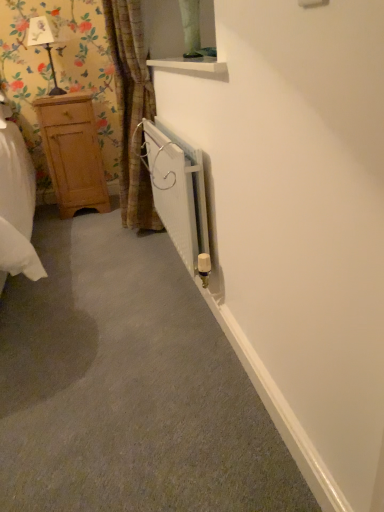
Question: Is brown textured curtain at left in front of white metallic radiator at center?

Choices:
 (A) no
 (B) yes

Answer: (A)

Question: Is brown textured curtain at left to the left of white metallic radiator at center from the viewer's perspective?

Choices:
 (A) yes
 (B) no

Answer: (A)

Question: Is brown textured curtain at left outside white metallic radiator at center?

Choices:
 (A) no
 (B) yes

Answer: (B)

Question: Are brown textured curtain at left and white metallic radiator at center located far from each other?

Choices:
 (A) no
 (B) yes

Answer: (A)

Question: From the image's perspective, is brown textured curtain at left above white metallic radiator at center?

Choices:
 (A) yes
 (B) no

Answer: (A)

Question: Considering the relative positions of brown textured curtain at left and white metallic radiator at center in the image provided, is brown textured curtain at left to the left or to the right of white metallic radiator at center?

Choices:
 (A) left
 (B) right

Answer: (A)

Question: Is brown textured curtain at left in front of or behind white metallic radiator at center in the image?

Choices:
 (A) behind
 (B) front

Answer: (A)

Question: Considering the positions of point (130, 220) and point (185, 153), is point (130, 220) closer or farther from the camera than point (185, 153)?

Choices:
 (A) closer
 (B) farther

Answer: (B)

Question: From their relative heights in the image, would you say brown textured curtain at left is taller or shorter than white metallic radiator at center?

Choices:
 (A) short
 (B) tall

Answer: (B)

Question: Do you think light brown wooden dresser at left is within matte black lamp at upper left, or outside of it?

Choices:
 (A) outside
 (B) inside

Answer: (A)

Question: In terms of size, does light brown wooden dresser at left appear bigger or smaller than matte black lamp at upper left?

Choices:
 (A) big
 (B) small

Answer: (A)

Question: Relative to matte black lamp at upper left, is light brown wooden dresser at left in front or behind?

Choices:
 (A) behind
 (B) front

Answer: (A)

Question: Looking at their shapes, would you say light brown wooden dresser at left is wider or thinner than matte black lamp at upper left?

Choices:
 (A) wide
 (B) thin

Answer: (A)

Question: In the image, is white metallic radiator at center positioned in front of or behind matte black lamp at upper left?

Choices:
 (A) behind
 (B) front

Answer: (B)

Question: From the image's perspective, is white metallic radiator at center positioned above or below matte black lamp at upper left?

Choices:
 (A) above
 (B) below

Answer: (B)